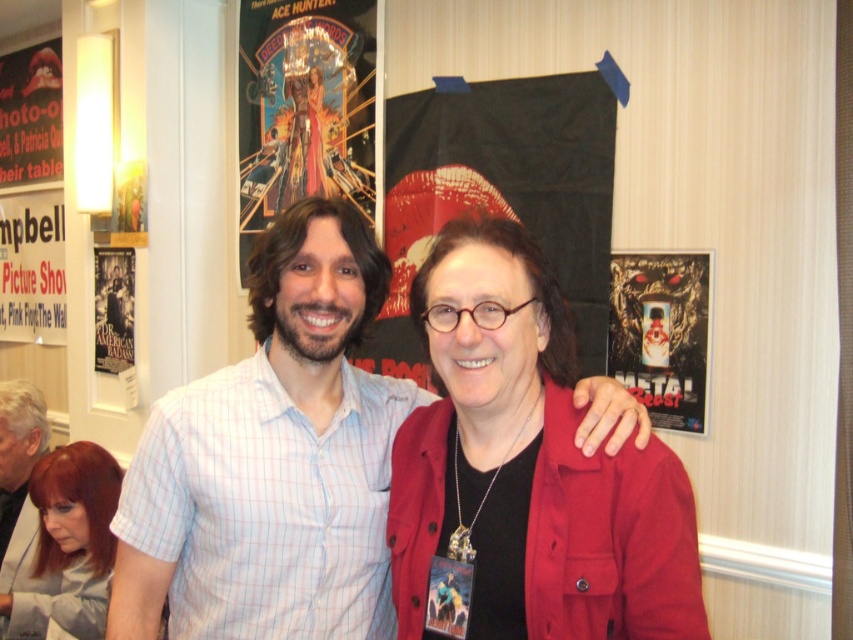
Looking at this image, you are a photographer trying to capture a closeup of the ACE HUNTER poster in the background. The camera you are using has a limited field of view. The ACE HUNTER poster is located at the center of the image. There is an obstruction in the form of a red jacket worn by the person on the right. The obstruction is at point (527, 467). To avoid the obstruction, you need to know if the ACE HUNTER poster is to the left or right of the red jacket. Which side is the ACE HUNTER poster relative to the red jacket?

The ACE HUNTER poster is at the center of the image, and the point (527, 467) marks the matte red jacket at center. Since both are at the center, the ACE HUNTER poster is directly behind the red jacket, making it obscured.

You are a photographer trying to capture a closeup of the shiny red hair at lower left. According to the coordinates provided, where should you focus your camera lens?

The shiny red hair at lower left is located at point (62, 547), so focus the camera lens there.

You are a photographer adjusting your camera settings to capture the ACE HUNTER poster in the background. The poster has a woman in a red dress. There is a point labeled as point (62, 547) in the image. What is the purpose of this point?

The point (62, 547) indicates the location of shiny red hair at lower left, which is part of the ACE HUNTER poster illustration.